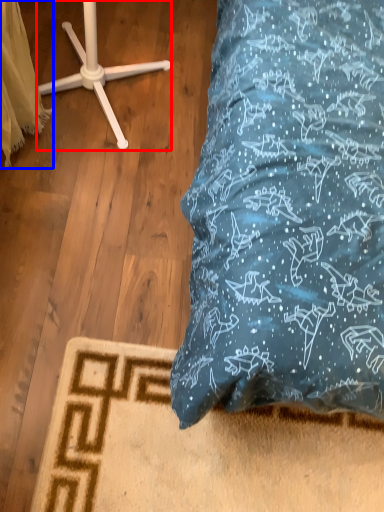
Question: Which object appears closest to the camera in this image, furniture (highlighted by a red box) or material (highlighted by a blue box)?

Choices:
 (A) furniture
 (B) material

Answer: (B)